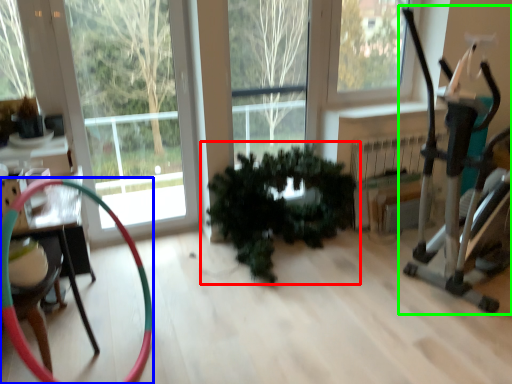
Question: Which object is positioned farthest from houseplant (highlighted by a red box)? Select from garden hose (highlighted by a blue box) and baby carriage (highlighted by a green box).

Choices:
 (A) garden hose
 (B) baby carriage

Answer: (A)